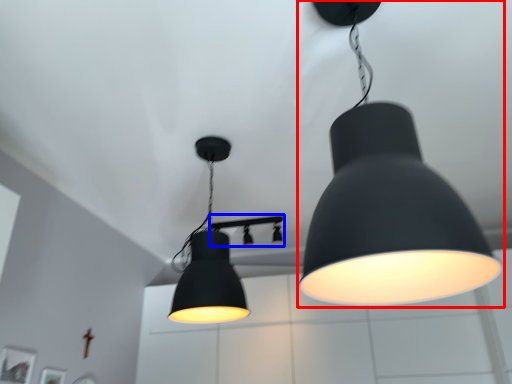
Question: Among these objects, which one is farthest to the camera, lamp (highlighted by a red box) or lamp (highlighted by a blue box)?

Choices:
 (A) lamp
 (B) lamp

Answer: (B)